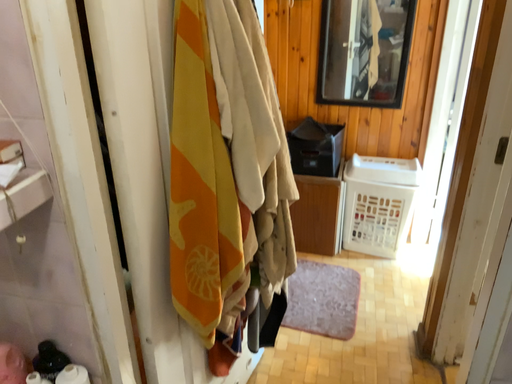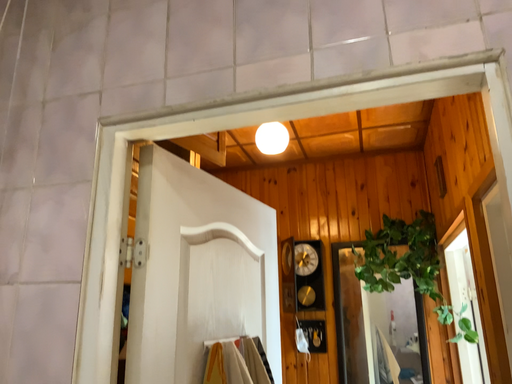
Question: Which way did the camera rotate in the video?

Choices:
 (A) rotated upward
 (B) rotated downward

Answer: (A)